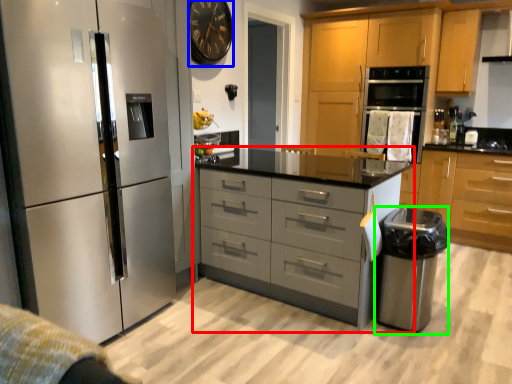
Question: Which is farther away from chest of drawers (highlighted by a red box)? clock (highlighted by a blue box) or appliance (highlighted by a green box)?

Choices:
 (A) clock
 (B) appliance

Answer: (A)